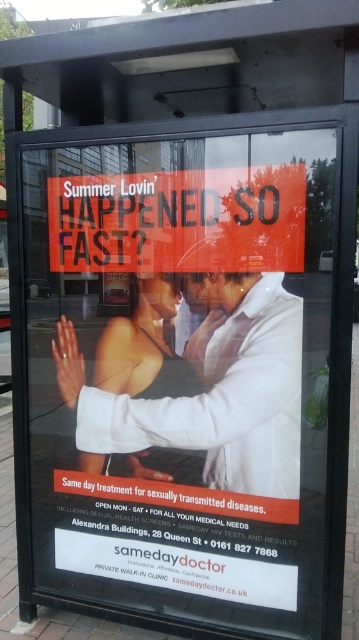
Question: Which of the following is the closest to the observer?

Choices:
 (A) white glossy shirt at center
 (B) orange matte poster at center

Answer: (B)

Question: Is white glossy shirt at center to the right of orange matte poster at center from the viewer's perspective?

Choices:
 (A) yes
 (B) no

Answer: (A)

Question: Does white glossy shirt at center have a larger size compared to orange matte poster at center?

Choices:
 (A) yes
 (B) no

Answer: (A)

Question: Which of the following is the closest to the observer?

Choices:
 (A) (170, 404)
 (B) (77, 266)

Answer: (A)

Question: Can you confirm if white glossy shirt at center is positioned to the left of orange matte poster at center?

Choices:
 (A) no
 (B) yes

Answer: (A)